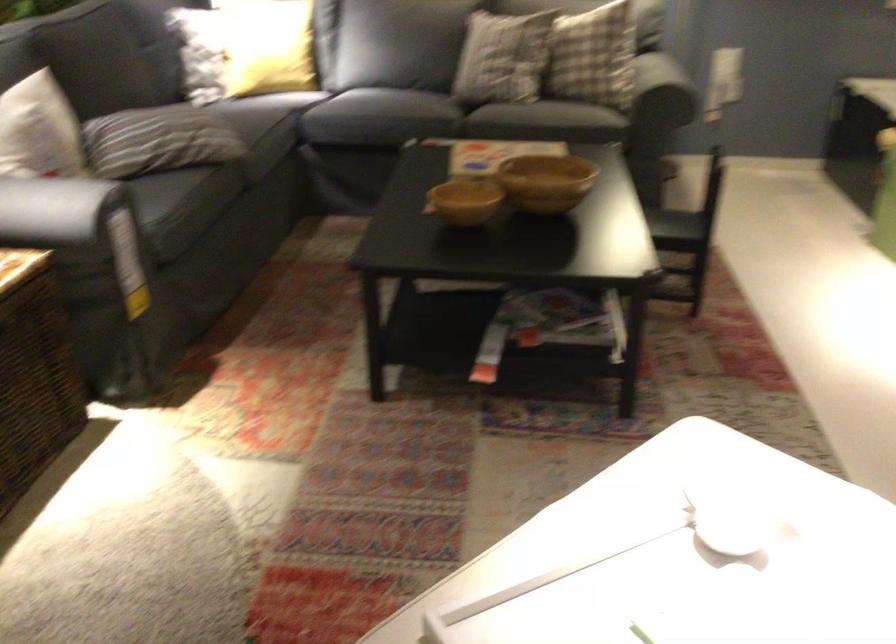
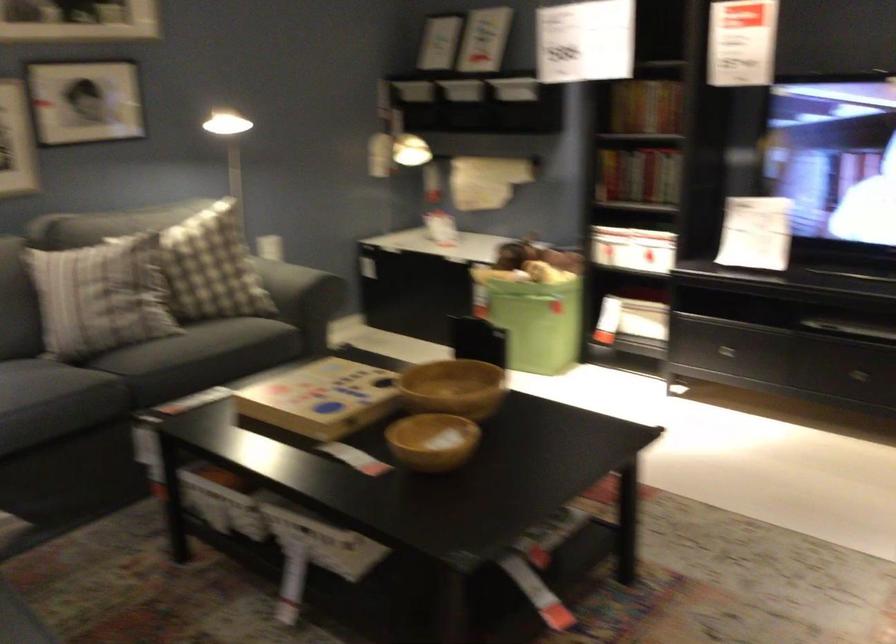
Find the pixel in the second image that matches the point at 478,156 in the first image.

(320, 399)